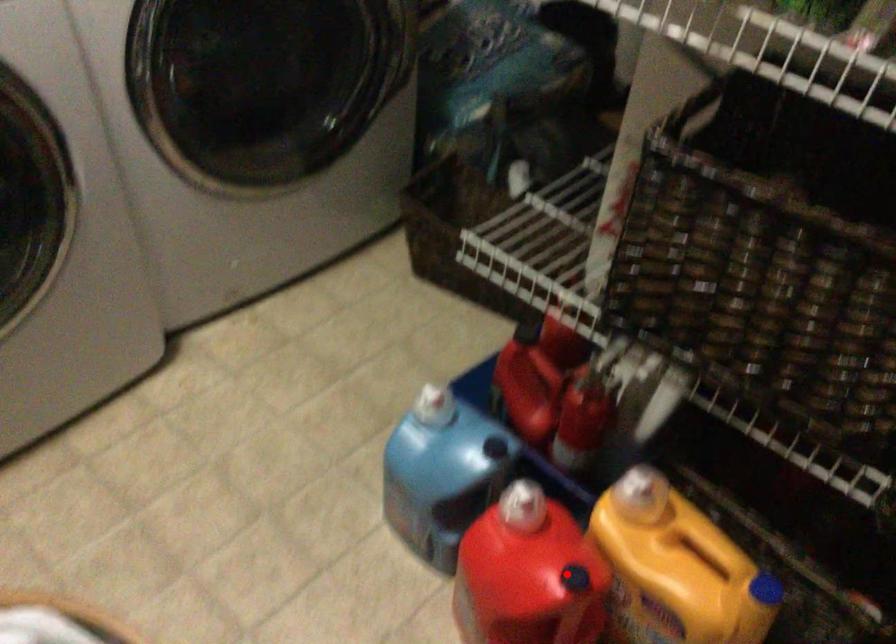
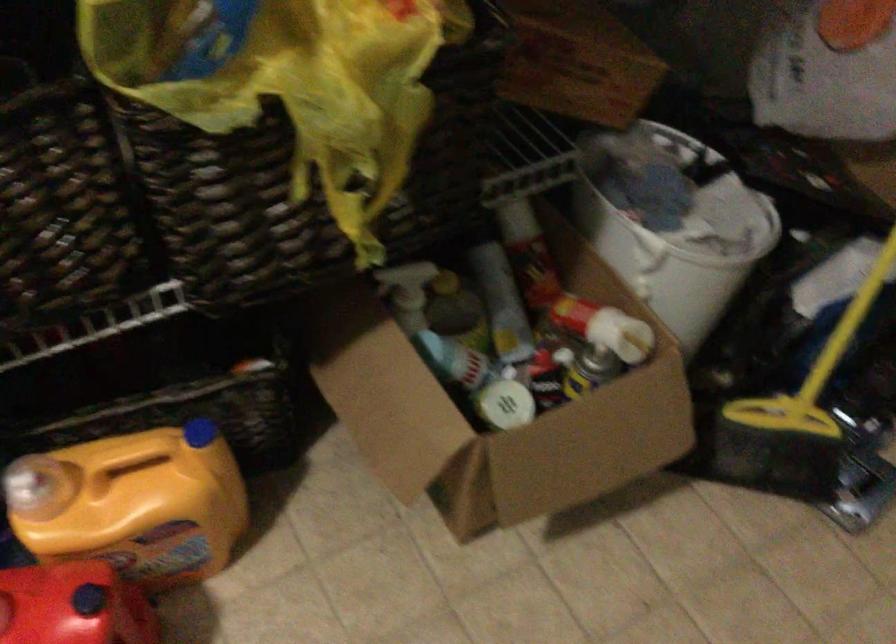
Question: A red point is marked in image1. In image2, is the corresponding 3D point closer to the camera or farther? Reply with the corresponding letter.

Choices:
 (A) The corresponding 3D point is closer.
 (B) The corresponding 3D point is farther.

Answer: (A)